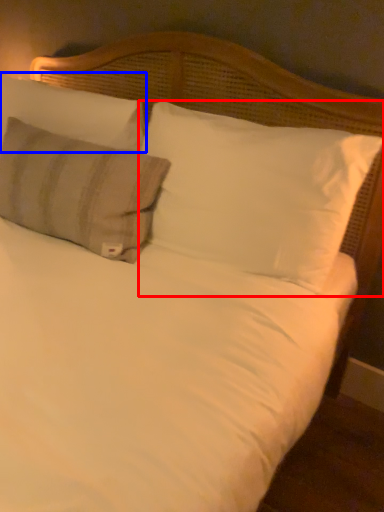
Question: Among these objects, which one is farthest to the camera, pillow (highlighted by a red box) or pillow (highlighted by a blue box)?

Choices:
 (A) pillow
 (B) pillow

Answer: (B)